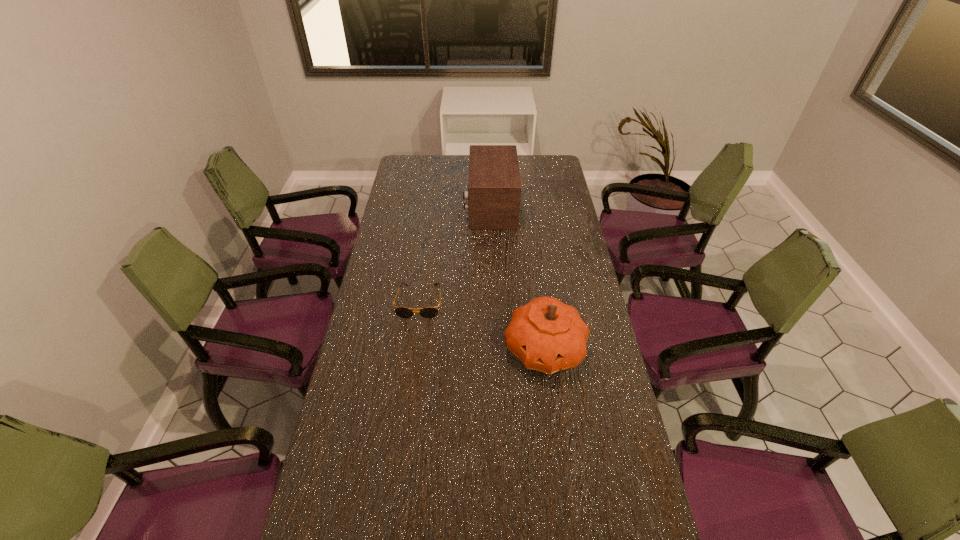
I want to click on object that is at the right edge, so click(x=547, y=335).

This screenshot has width=960, height=540. I want to click on vacant point at the left edge, so click(379, 397).

Locate an element on the screen. vacant area at the right edge of the desktop is located at coordinates (557, 215).

Identify the location of vacant region between the pumpkin and the radio receiver. The image size is (960, 540). (517, 278).

You are a GUI agent. You are given a task and a screenshot of the screen. Output one action in this format:
    pyautogui.click(x=<x>, y=<y>)
    Task: Click on the vacant area that lies between the pumpkin and the leftmost object
    
    Given the screenshot: What is the action you would take?
    pyautogui.click(x=482, y=326)

At what (x,y) coordinates should I click in order to perform the action: click on free space between the pumpkin and the sunglasses. Please return your answer as a coordinate pair (x, y). The height and width of the screenshot is (540, 960). Looking at the image, I should click on (482, 326).

The width and height of the screenshot is (960, 540). I want to click on object that stands as the second closest to the farthest object, so click(547, 335).

You are a GUI agent. You are given a task and a screenshot of the screen. Output one action in this format:
    pyautogui.click(x=<x>, y=<y>)
    Task: Click on the second closest object relative to the pumpkin
    This screenshot has height=540, width=960.
    Given the screenshot: What is the action you would take?
    pyautogui.click(x=494, y=187)

At what (x,y) coordinates should I click in order to perform the action: click on free space that satisfies the following two spatial constraints: 1. on the front-facing side of the farthest object; 2. on the front-facing side of the leftmost object. Please return your answer as a coordinate pair (x, y). Looking at the image, I should click on (493, 302).

What are the coordinates of `free location that satisfies the following two spatial constraints: 1. on the front-facing side of the radio receiver; 2. on the front-facing side of the leftmost object` in the screenshot? It's located at (493, 302).